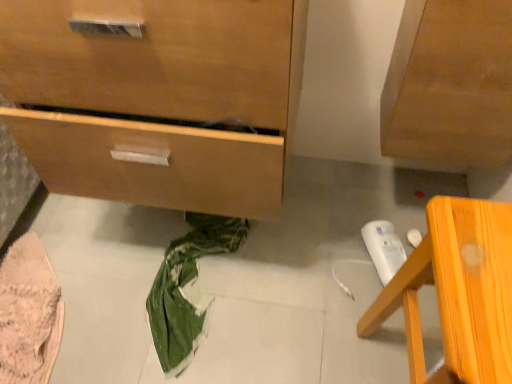
Locate an element on the screen. The width and height of the screenshot is (512, 384). free spot to the right of pink knitted fabric at lower left is located at coordinates (143, 332).